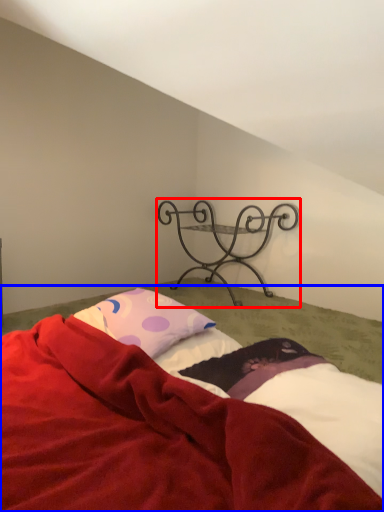
Question: Which of the following is the farthest to the observer, furniture (highlighted by a red box) or bed (highlighted by a blue box)?

Choices:
 (A) furniture
 (B) bed

Answer: (A)